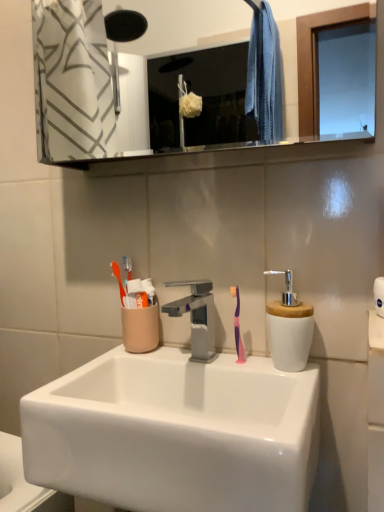
The width and height of the screenshot is (384, 512). I want to click on free point to the right of satin nickel faucet at center, so click(250, 368).